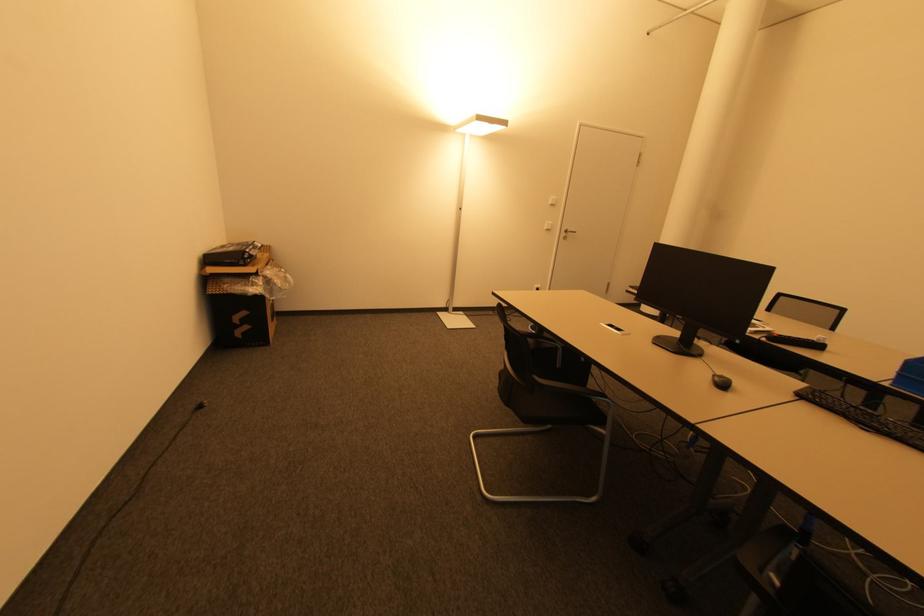
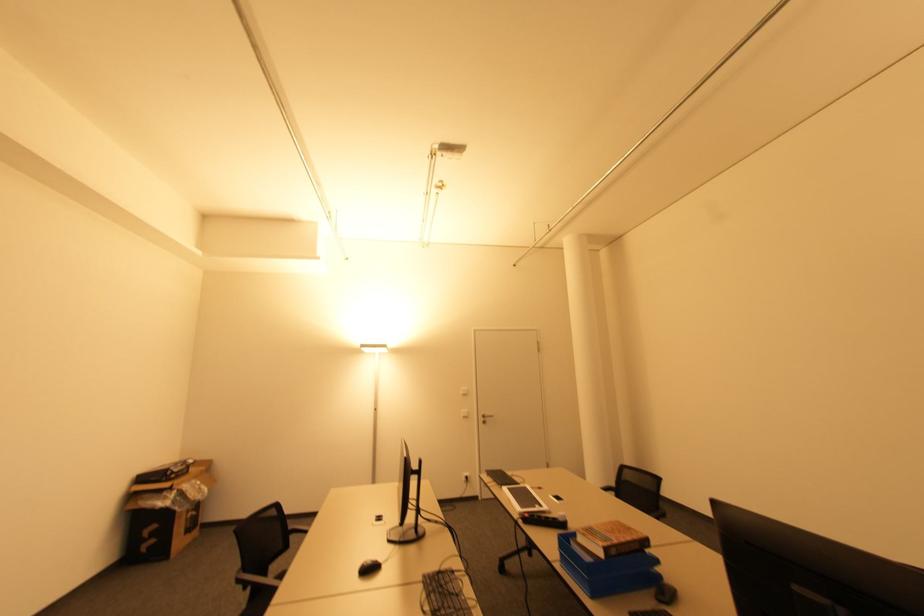
Where in the second image is the point corresponding to (x=555, y=204) from the first image?

(468, 392)